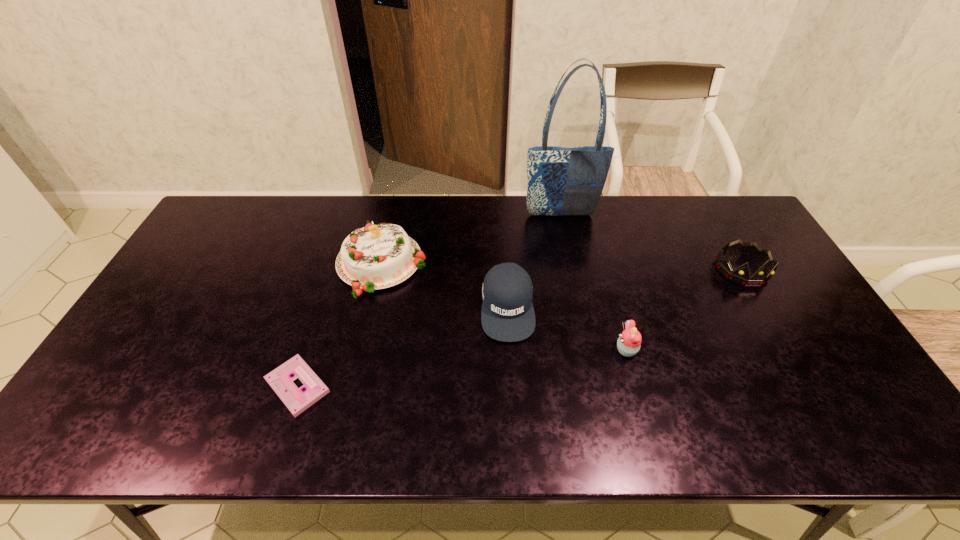
Find the location of a particular element. The height and width of the screenshot is (540, 960). object that can be found as the fourth closest to the rightmost object is located at coordinates (380, 256).

Where is `the closest object relative to the fifth shortest object`? The image size is (960, 540). the closest object relative to the fifth shortest object is located at coordinates (507, 315).

Find the location of a particular element. Image resolution: width=960 pixels, height=540 pixels. vacant space that satisfies the following two spatial constraints: 1. at the front of the rightmost object with jewels; 2. on the face of the cupcake is located at coordinates (788, 350).